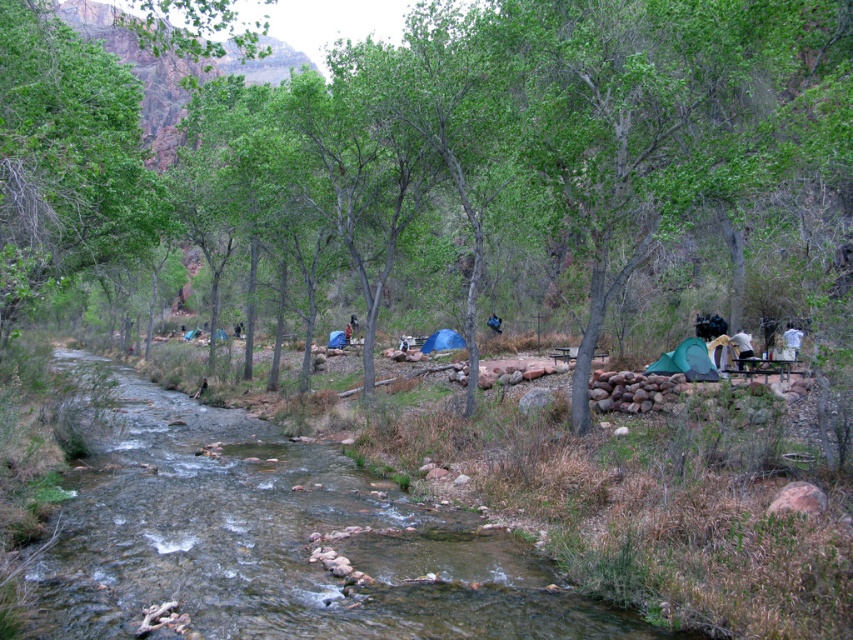
Does point (573, 428) lie in front of point (426, 349)?

That is True.

Image resolution: width=853 pixels, height=640 pixels. Identify the location of green leafy tree at center. (463, 163).

Which of these two, green fabric tent at lower right or blue fabric tent at center, stands taller?

Standing taller between the two is green fabric tent at lower right.

Consider the image. Who is lower down, green fabric tent at lower right or blue fabric tent at center?

green fabric tent at lower right

Identify the location of green fabric tent at lower right. The image size is (853, 640). (686, 362).

You are a GUI agent. You are given a task and a screenshot of the screen. Output one action in this format:
    pyautogui.click(x=<x>, y=<y>)
    Task: Click on the green fabric tent at lower right
    This screenshot has width=853, height=640.
    Given the screenshot: What is the action you would take?
    pyautogui.click(x=686, y=362)

Who is higher up, green leafy tree at center or clear water stream at center?

green leafy tree at center is higher up.

Does point (425, 156) lie in front of point (177, 508)?

No.

From the picture: Who is more distant from viewer, (692, 202) or (166, 600)?

Positioned behind is point (692, 202).

In order to click on green leafy tree at center in this screenshot , I will do `click(463, 163)`.